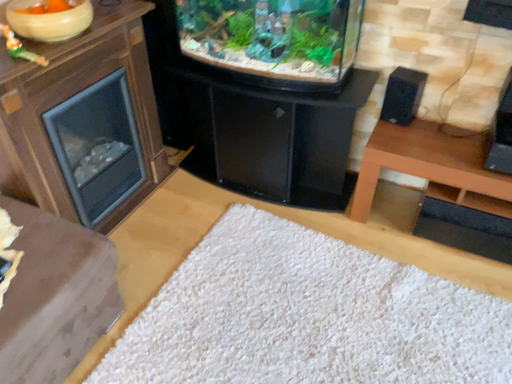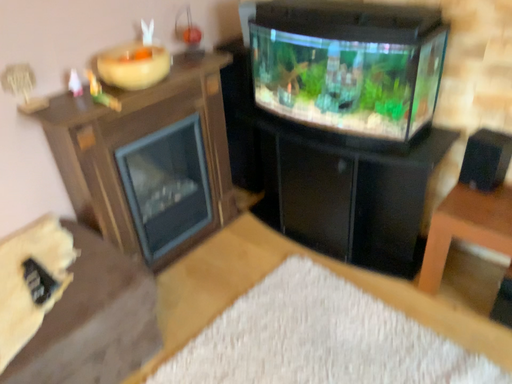
Question: How did the camera likely rotate when shooting the video?

Choices:
 (A) rotated left
 (B) rotated right

Answer: (A)